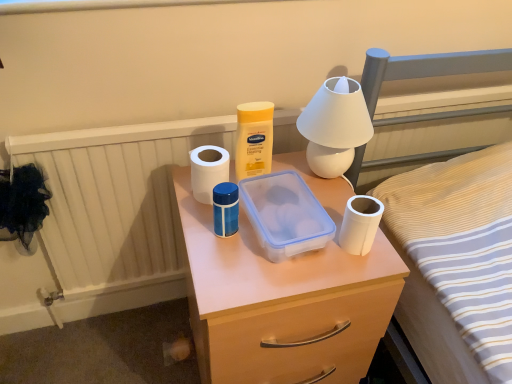
This screenshot has height=384, width=512. In order to click on free space above translucent plastic container at center (from a real-world perspective) in this screenshot , I will do `click(286, 230)`.